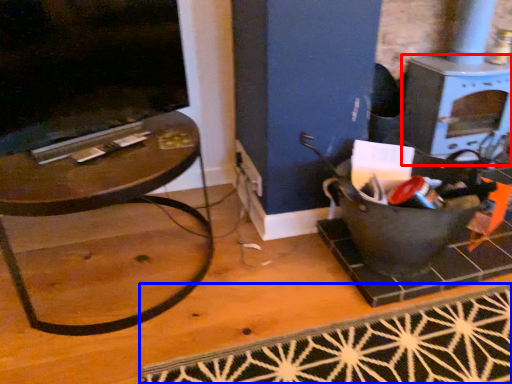
Question: Among these objects, which one is nearest to the camera, stove (highlighted by a red box) or doormat (highlighted by a blue box)?

Choices:
 (A) stove
 (B) doormat

Answer: (B)